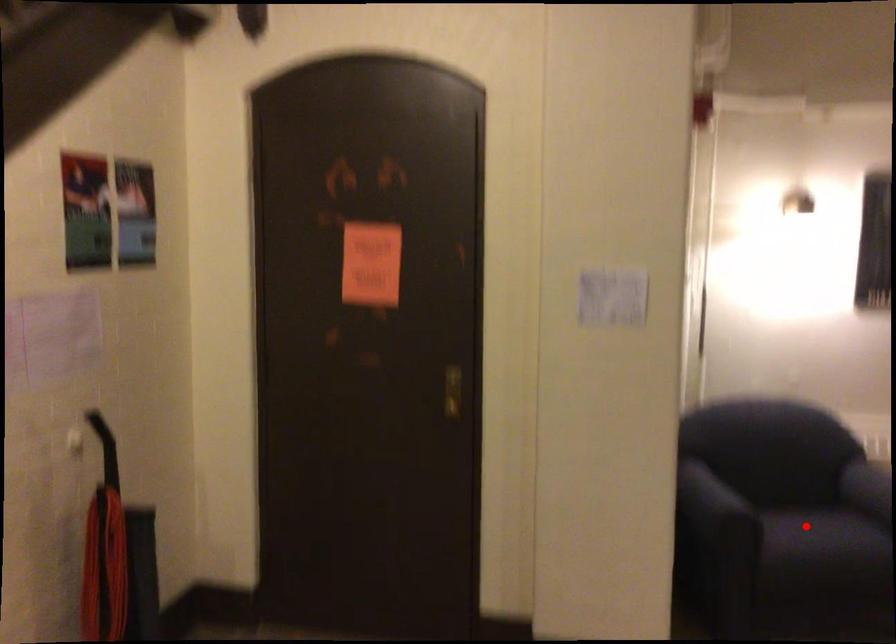
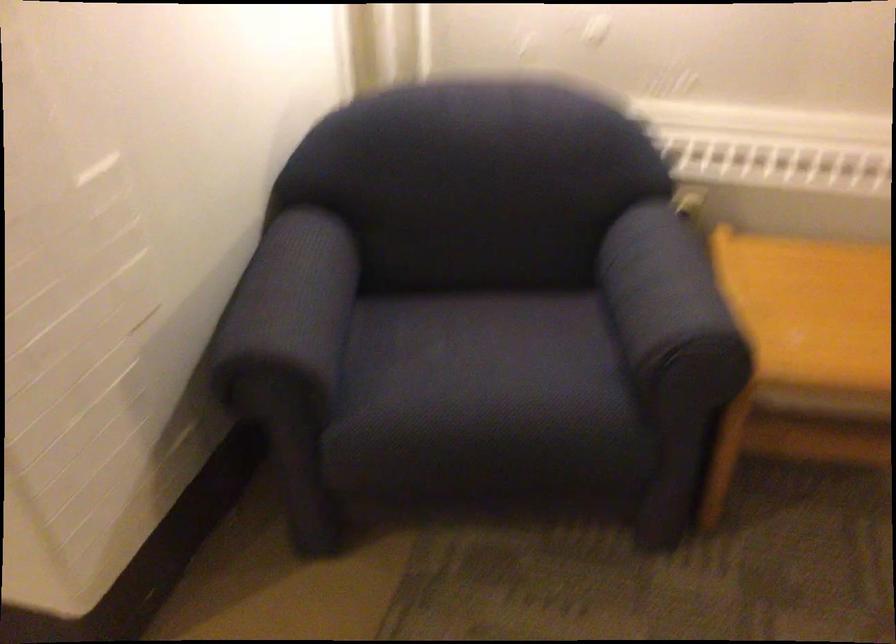
The point at the highlighted location is marked in the first image. Where is the corresponding point in the second image?

(485, 366)